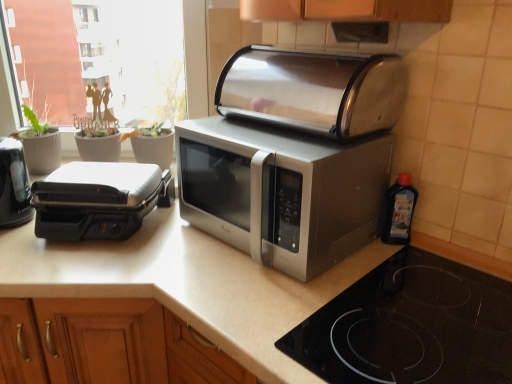
Question: Can you confirm if black plastic toaster at left, which ranks as the 3th toaster in right-to-left order, is wider than stainless steel toaster at center, the first toaster positioned from the right?

Choices:
 (A) yes
 (B) no

Answer: (B)

Question: Is black plastic toaster at left, which ranks as the 3th toaster in right-to-left order, thinner than stainless steel toaster at center, the first toaster positioned from the right?

Choices:
 (A) yes
 (B) no

Answer: (A)

Question: Is stainless steel toaster at center, the 3th toaster viewed from the left, a part of black plastic toaster at left, which ranks as the 3th toaster in right-to-left order?

Choices:
 (A) yes
 (B) no

Answer: (B)

Question: Is black plastic toaster at left, which ranks as the 3th toaster in right-to-left order, beside stainless steel toaster at center, the first toaster positioned from the right?

Choices:
 (A) no
 (B) yes

Answer: (A)

Question: Is black plastic toaster at left, which ranks as the 3th toaster in right-to-left order, at the right side of stainless steel toaster at center, the first toaster positioned from the right?

Choices:
 (A) yes
 (B) no

Answer: (B)

Question: Considering the positions of black glass cooktop at lower right and black plastic toaster at left, which ranks as the 3th toaster in right-to-left order, in the image, is black glass cooktop at lower right bigger or smaller than black plastic toaster at left, which ranks as the 3th toaster in right-to-left order,?

Choices:
 (A) small
 (B) big

Answer: (B)

Question: Considering the positions of black glass cooktop at lower right and black plastic toaster at left, marked as the 1th toaster in a left-to-right arrangement, in the image, is black glass cooktop at lower right taller or shorter than black plastic toaster at left, marked as the 1th toaster in a left-to-right arrangement,?

Choices:
 (A) short
 (B) tall

Answer: (A)

Question: Looking at their shapes, would you say black glass cooktop at lower right is wider or thinner than black plastic toaster at left, marked as the 1th toaster in a left-to-right arrangement?

Choices:
 (A) wide
 (B) thin

Answer: (A)

Question: Is black glass cooktop at lower right spatially inside black plastic toaster at left, which ranks as the 3th toaster in right-to-left order, or outside of it?

Choices:
 (A) inside
 (B) outside

Answer: (B)

Question: From the image's perspective, relative to black plastic toaster at left, marked as the 1th toaster in a left-to-right arrangement, is satin silver microwave at center above or below?

Choices:
 (A) below
 (B) above

Answer: (B)

Question: From a real-world perspective, is satin silver microwave at center positioned above or below black plastic toaster at left, marked as the 1th toaster in a left-to-right arrangement?

Choices:
 (A) above
 (B) below

Answer: (A)

Question: Looking at the image, does satin silver microwave at center seem bigger or smaller compared to black plastic toaster at left, marked as the 1th toaster in a left-to-right arrangement?

Choices:
 (A) small
 (B) big

Answer: (B)

Question: Is satin silver microwave at center wider or thinner than black plastic toaster at left, marked as the 1th toaster in a left-to-right arrangement?

Choices:
 (A) thin
 (B) wide

Answer: (B)

Question: In terms of size, does transparent plastic window screen at upper left appear bigger or smaller than black glass cooktop at lower right?

Choices:
 (A) small
 (B) big

Answer: (B)

Question: Does point (15, 38) appear closer or farther from the camera than point (420, 306)?

Choices:
 (A) farther
 (B) closer

Answer: (A)